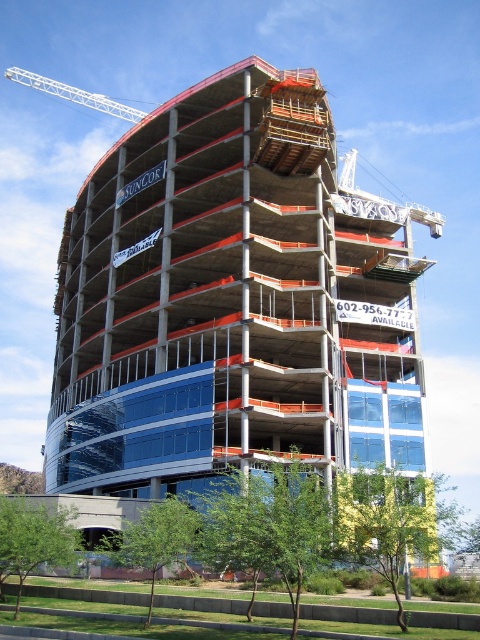
Question: Does concrete building at center appear on the right side of white metal crane at upper left?

Choices:
 (A) no
 (B) yes

Answer: (B)

Question: Which object appears closest to the camera in this image?

Choices:
 (A) white metal crane at upper left
 (B) concrete building at center

Answer: (B)

Question: Is the position of concrete building at center more distant than that of white metal crane at upper left?

Choices:
 (A) no
 (B) yes

Answer: (A)

Question: Can you confirm if concrete building at center is smaller than white metal crane at upper left?

Choices:
 (A) yes
 (B) no

Answer: (B)